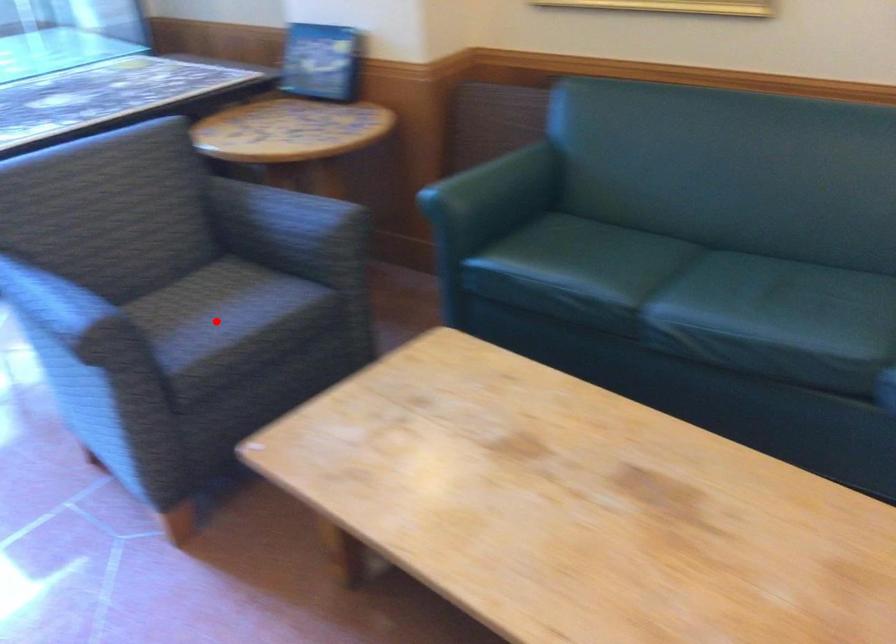
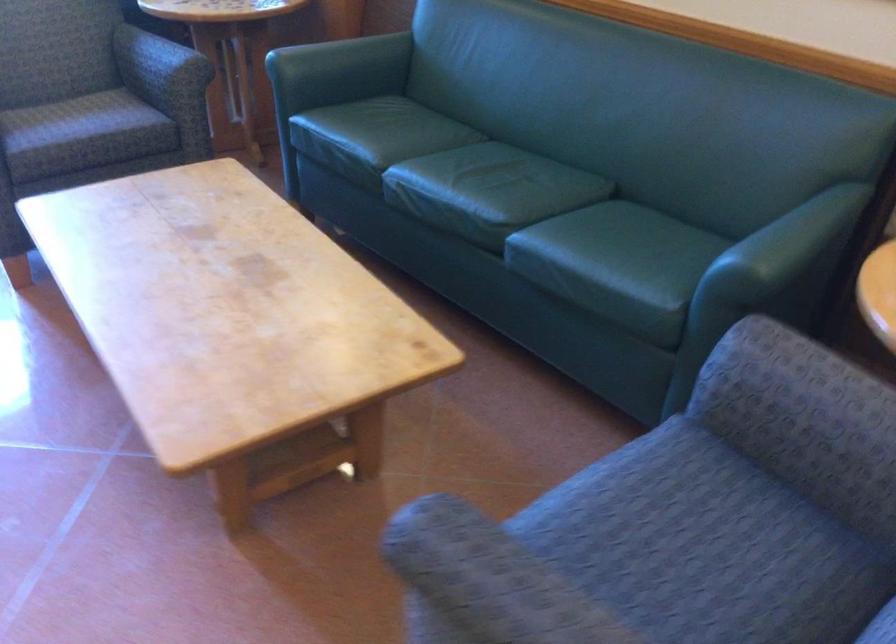
Question: I am providing you with two images of the same scene from different viewpoints. Image1 has a red point marked. In image2, the corresponding 3D location appears at what relative position? Reply with the corresponding letter.

Choices:
 (A) Closer
 (B) Farther

Answer: (B)